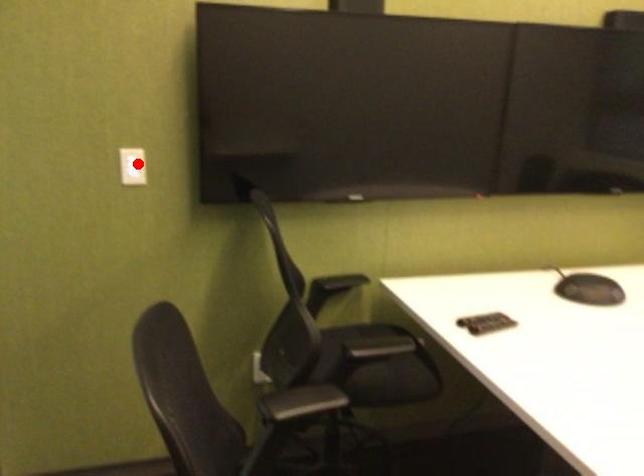
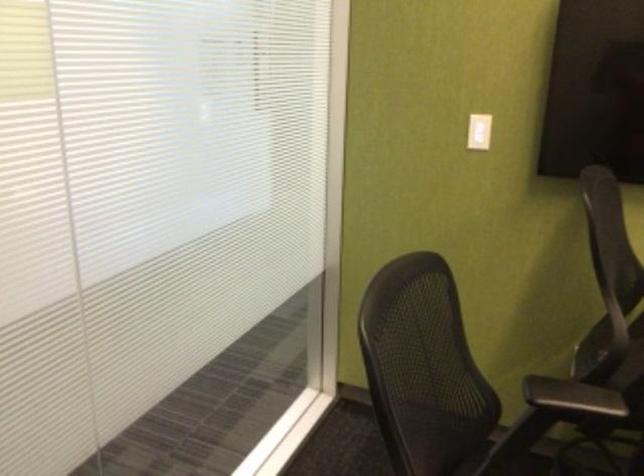
Locate, in the second image, the point that corresponds to the highlighted location in the first image.

(478, 131)